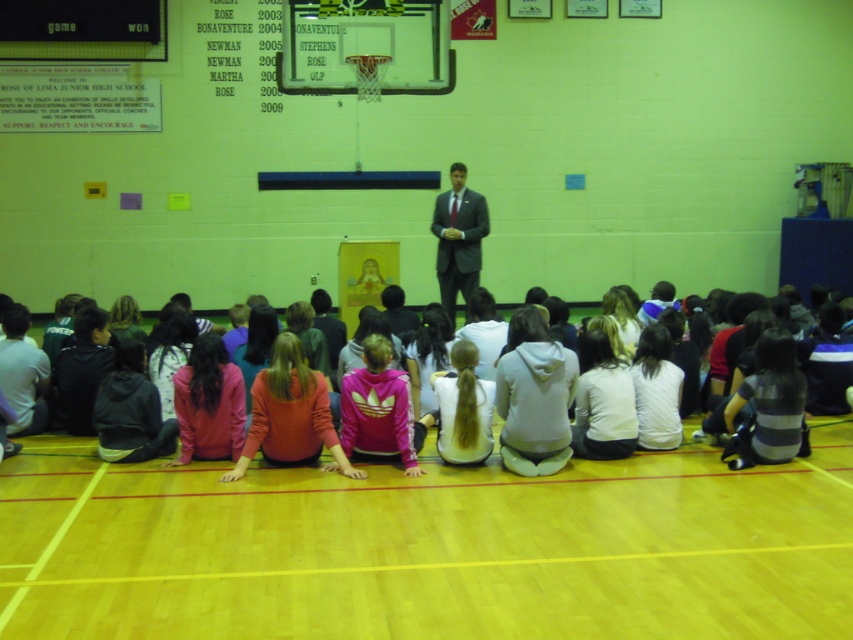
Looking at this image, you are a student sitting at the back of the gymnasium and want to hand a note to the person wearing the white hoodie at center and the matte gray suit at center. Which one can you reach first if you walk straight forward?

The white hoodie at center is in front of the matte gray suit at center, so you can reach the white hoodie at center first by walking straight forward.

You are a student sitting on the floor in the gymnasium. You need to locate the solid white jersey at center. Where should you look relative to the basketball court markings on the floor?

The solid white jersey at center is located at the coordinates point [434,484], which is near the center of the gymnasium floor, likely positioned over the basketball court markings.